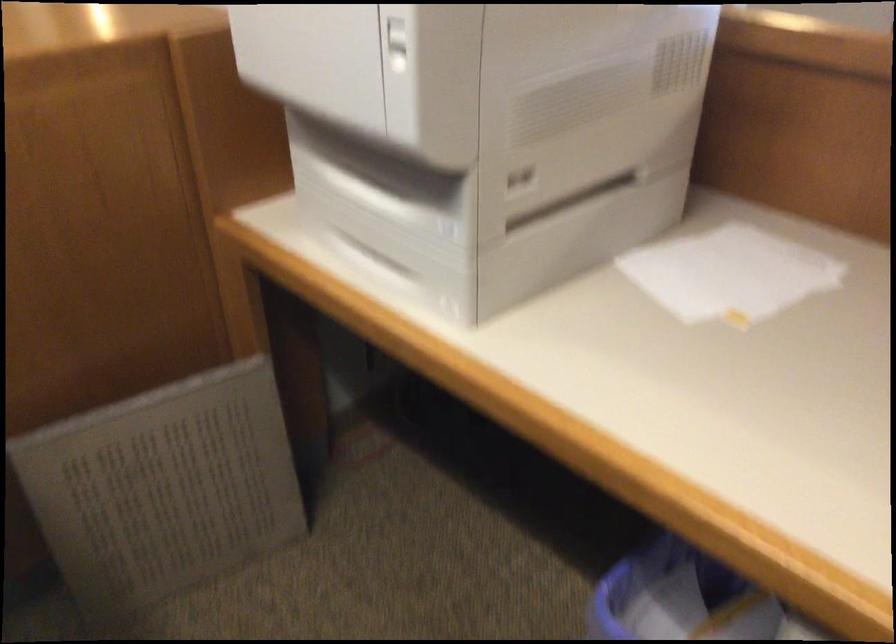
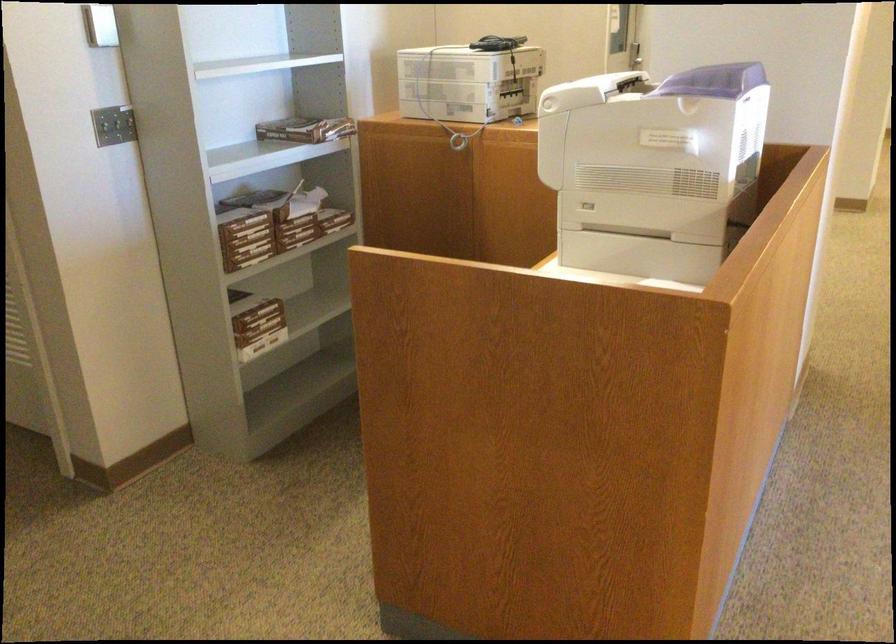
Where in the second image is the point corresponding to point (612, 251) from the first image?

(640, 254)